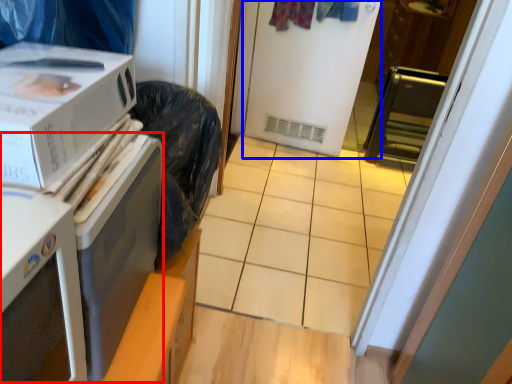
Question: Which object is closer to the camera taking this photo, appliance (highlighted by a red box) or screen door (highlighted by a blue box)?

Choices:
 (A) appliance
 (B) screen door

Answer: (A)